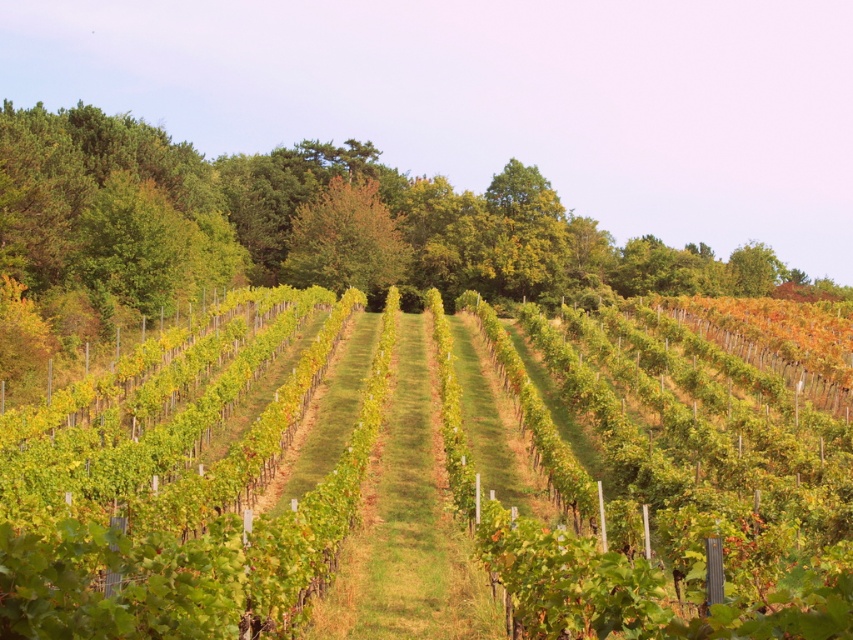
Question: Does green leafy vines at center come behind green leafy tree at center?

Choices:
 (A) no
 (B) yes

Answer: (A)

Question: Which point is farther to the camera?

Choices:
 (A) green leafy vines at center
 (B) green leafy tree at center

Answer: (B)

Question: Is green leafy vines at center in front of green leafy tree at center?

Choices:
 (A) no
 (B) yes

Answer: (B)

Question: Which point appears closest to the camera in this image?

Choices:
 (A) (372, 275)
 (B) (25, 570)

Answer: (B)

Question: Does green leafy vines at center have a larger size compared to green leafy tree at center?

Choices:
 (A) yes
 (B) no

Answer: (A)